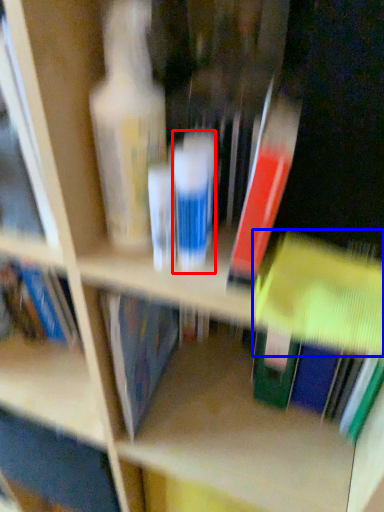
Question: Which object is closer to the camera taking this photo, toiletry (highlighted by a red box) or book (highlighted by a blue box)?

Choices:
 (A) toiletry
 (B) book

Answer: (B)